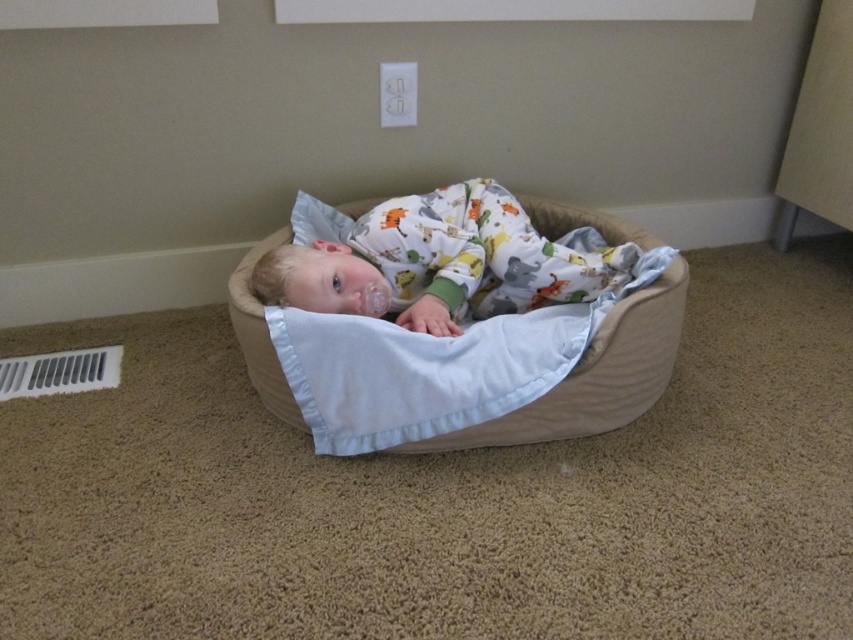
Question: Which point is farther from the camera taking this photo?

Choices:
 (A) (318, 204)
 (B) (581, 394)
 (C) (555, 300)

Answer: (A)

Question: Can you confirm if beige fabric infant bed at center is positioned to the left of white soft baby at center?

Choices:
 (A) no
 (B) yes

Answer: (A)

Question: Which object is the farthest from the white soft baby at center?

Choices:
 (A) white soft pillow at upper center
 (B) beige fabric infant bed at center

Answer: (A)

Question: From the image, what is the correct spatial relationship of beige fabric infant bed at center in relation to white soft pillow at upper center?

Choices:
 (A) right
 (B) left

Answer: (A)

Question: Is beige fabric infant bed at center smaller than white soft pillow at upper center?

Choices:
 (A) yes
 (B) no

Answer: (B)

Question: Which point is farther from the camera taking this photo?

Choices:
 (A) (488, 214)
 (B) (303, 228)
 (C) (241, 284)

Answer: (B)